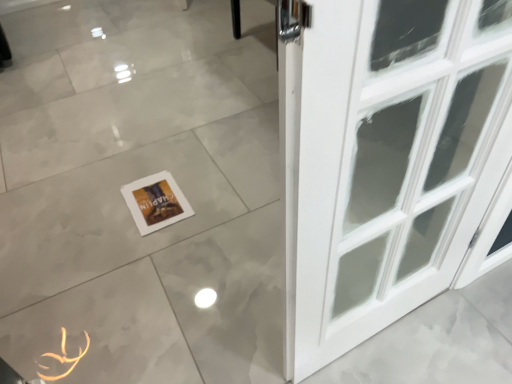
Where is `vacant space behind orange rubber band at lower left`? The width and height of the screenshot is (512, 384). vacant space behind orange rubber band at lower left is located at coordinates (79, 296).